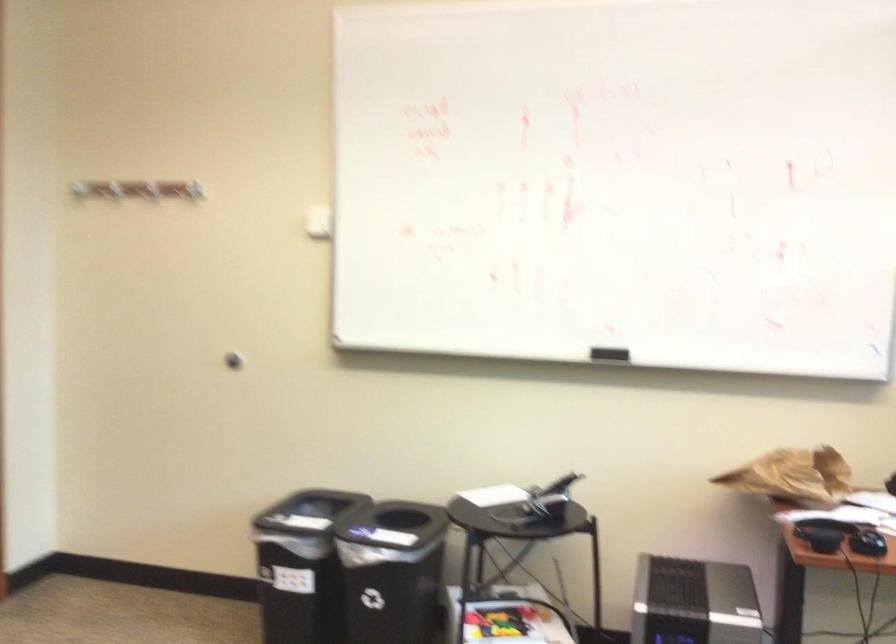
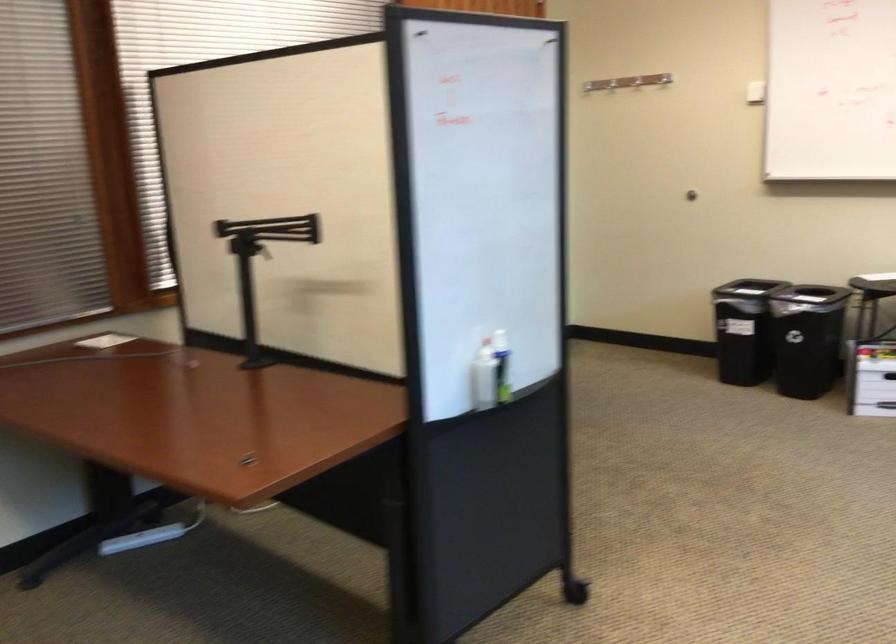
In the second image, find the point that corresponds to point 300,204 in the first image.

(664, 79)